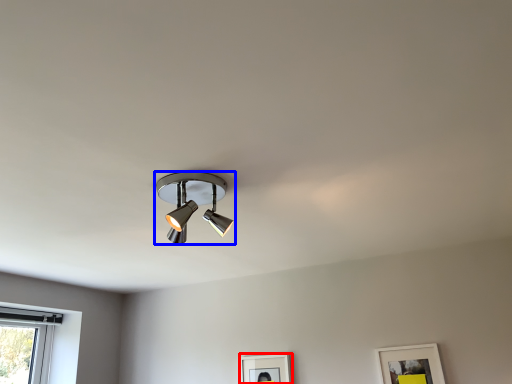
Question: Which object appears farthest to the camera in this image, picture frame (highlighted by a red box) or lamp (highlighted by a blue box)?

Choices:
 (A) picture frame
 (B) lamp

Answer: (A)